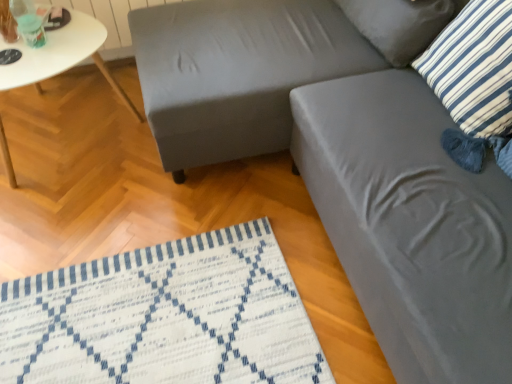
Where is `vacant space underneath white glossy table at left (from a real-world perspective)`? vacant space underneath white glossy table at left (from a real-world perspective) is located at coordinates (72, 140).